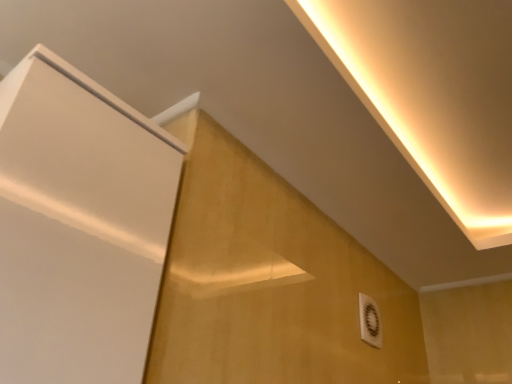
The width and height of the screenshot is (512, 384). Describe the element at coordinates (79, 226) in the screenshot. I see `white matte door at upper left` at that location.

The width and height of the screenshot is (512, 384). I want to click on white matte door at upper left, so click(x=79, y=226).

This screenshot has height=384, width=512. I want to click on white matte door at upper left, so click(79, 226).